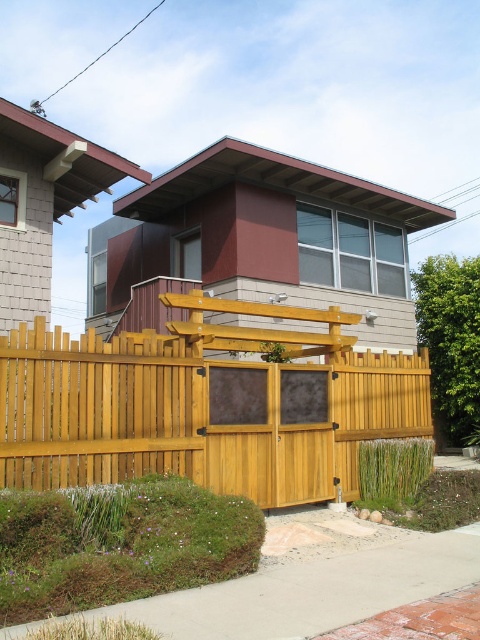
Question: Can you confirm if light brown wood fence at center is positioned above green grass at lower left?

Choices:
 (A) no
 (B) yes

Answer: (B)

Question: Does light brown wood fence at center appear on the right side of green grass at lower left?

Choices:
 (A) no
 (B) yes

Answer: (B)

Question: Does light brown wood fence at center appear on the right side of green grass at lower left?

Choices:
 (A) yes
 (B) no

Answer: (A)

Question: Which of the following is the farthest from the observer?

Choices:
 (A) green grass at lower left
 (B) light brown wood fence at center

Answer: (B)

Question: Which of the following is the farthest from the observer?

Choices:
 (A) (387, 426)
 (B) (260, 513)

Answer: (A)